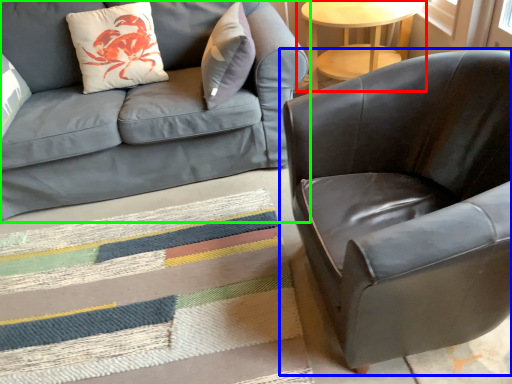
Question: Considering the real-world distances, which object is farthest from table (highlighted by a red box)? chair (highlighted by a blue box) or studio couch (highlighted by a green box)?

Choices:
 (A) chair
 (B) studio couch

Answer: (A)